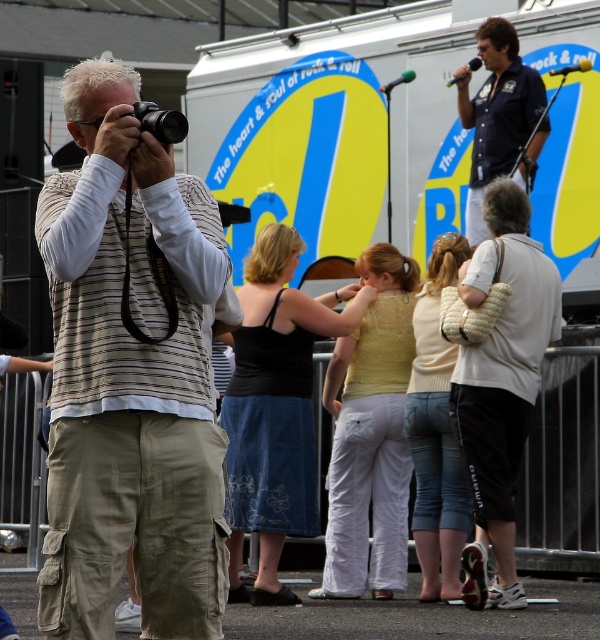
Question: Which object is farther from the camera taking this photo?

Choices:
 (A) dark blue shirt at upper right
 (B) white textured shirt at center

Answer: (A)

Question: Does dark blue shirt at upper right have a greater width compared to black plastic camera at left?

Choices:
 (A) no
 (B) yes

Answer: (A)

Question: In this image, where is striped fabric camera at left located relative to dark blue shirt at upper right?

Choices:
 (A) right
 (B) left

Answer: (B)

Question: In this image, where is striped fabric camera at left located relative to dark blue shirt at upper right?

Choices:
 (A) below
 (B) above

Answer: (A)

Question: Which object is farther from the camera taking this photo?

Choices:
 (A) black plastic camera at left
 (B) striped fabric camera at left

Answer: (B)

Question: Which object is the closest to the white textured shirt at center?

Choices:
 (A) dark blue shirt at upper right
 (B) black plastic camera at left
 (C) striped fabric camera at left

Answer: (B)